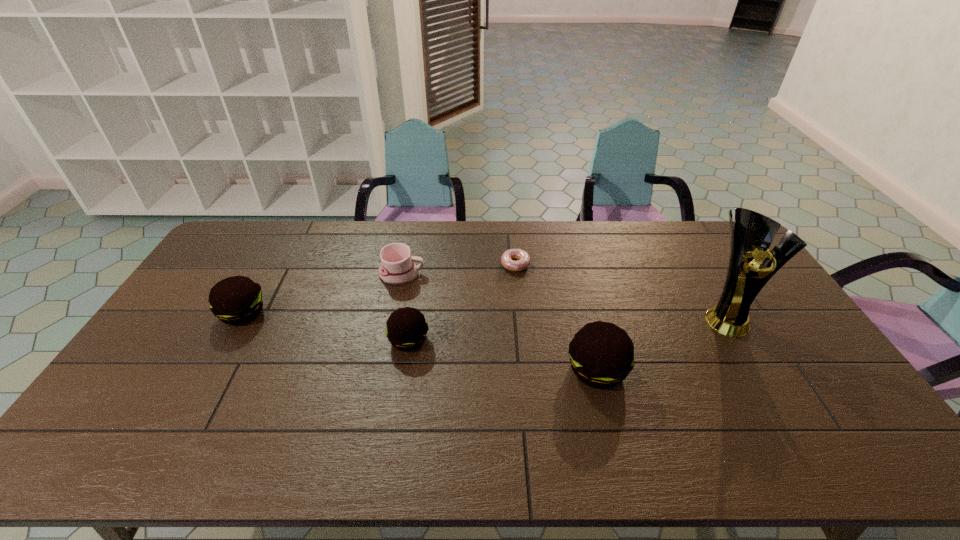
This screenshot has width=960, height=540. Find the location of `vacant space located 0.240m on the left of the shortest patty`. vacant space located 0.240m on the left of the shortest patty is located at coordinates (306, 340).

Where is `vacant region located on the back of the rightmost patty`? This screenshot has height=540, width=960. vacant region located on the back of the rightmost patty is located at coordinates (573, 272).

You are a GUI agent. You are given a task and a screenshot of the screen. Output one action in this format:
    pyautogui.click(x=<x>, y=<y>)
    Task: Click on the vacant space situated 0.140m at the front of the award, where the globe is visible
    The image size is (960, 540).
    Given the screenshot: What is the action you would take?
    pyautogui.click(x=758, y=376)

The image size is (960, 540). In order to click on vacant space located on the side with the handle of the mug in this screenshot , I will do `click(470, 274)`.

Identify the location of vacant area located 0.360m on the right of the fourth object from left to right. The height and width of the screenshot is (540, 960). (632, 265).

The width and height of the screenshot is (960, 540). Identify the location of object that is at the far edge. (523, 259).

In order to click on object that is at the near edge in this screenshot , I will do `click(601, 354)`.

Identify the location of object situated at the left edge. (236, 300).

Where is `object present at the right edge`? object present at the right edge is located at coordinates (751, 235).

Identify the location of vacant space at the far edge. This screenshot has height=540, width=960. (349, 221).